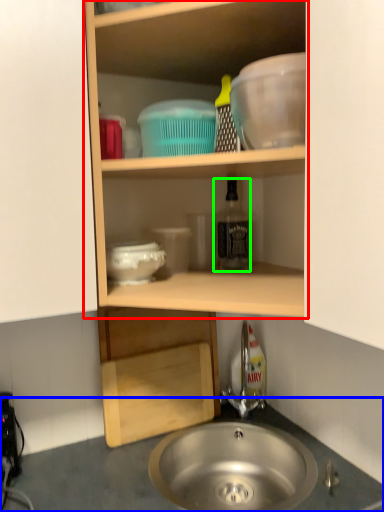
Question: Estimate the real-world distances between objects in this image. Which object is closer to shelf (highlighted by a red box), countertop (highlighted by a blue box) or bottle (highlighted by a green box)?

Choices:
 (A) countertop
 (B) bottle

Answer: (B)